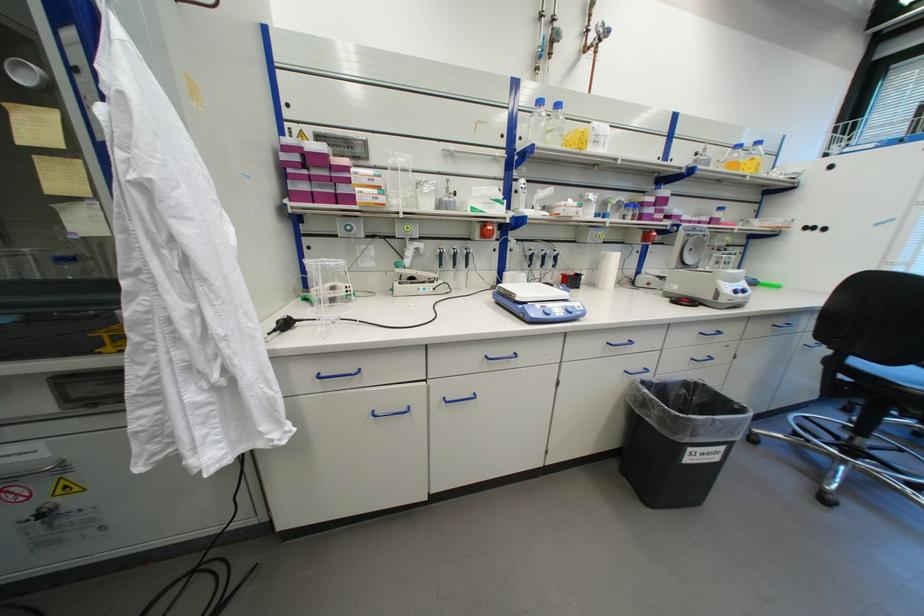
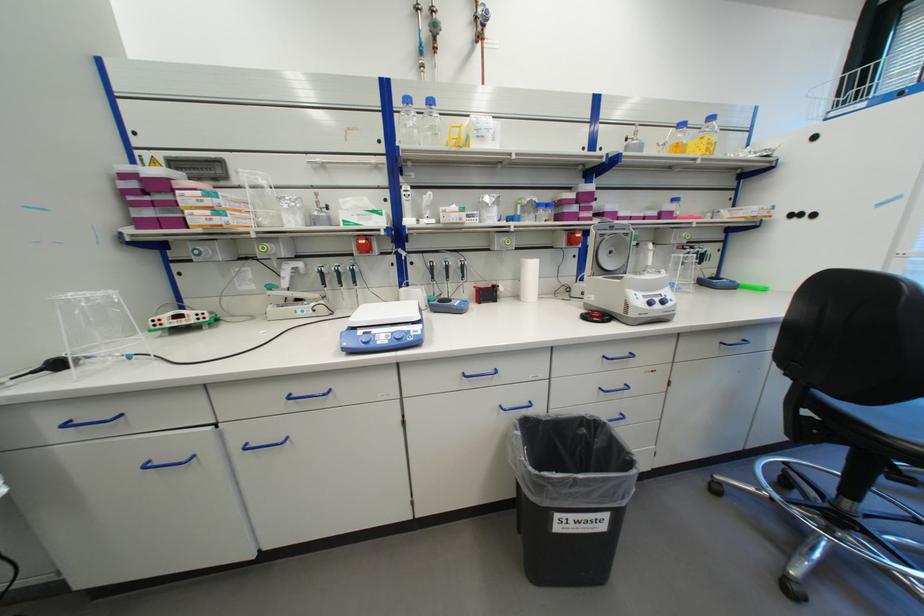
Locate, in the second image, the point that corresponds to pixel 341 192 in the first image.

(188, 216)